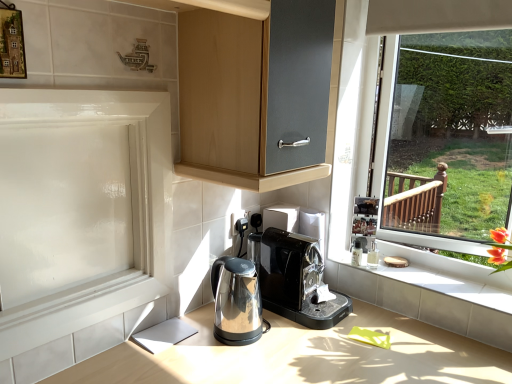
At what (x,y) coordinates should I click in order to perform the action: click on free space above stainless steel kettle at lower center, placed as the first home appliance when sorted from left to right (from a real-world perspective). Please return your answer as a coordinate pair (x, y). This screenshot has width=512, height=384. Looking at the image, I should click on (238, 267).